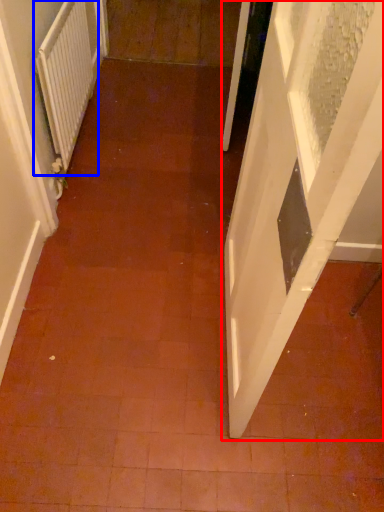
Question: Which object appears closest to the camera in this image, door (highlighted by a red box) or radiator (highlighted by a blue box)?

Choices:
 (A) door
 (B) radiator

Answer: (A)